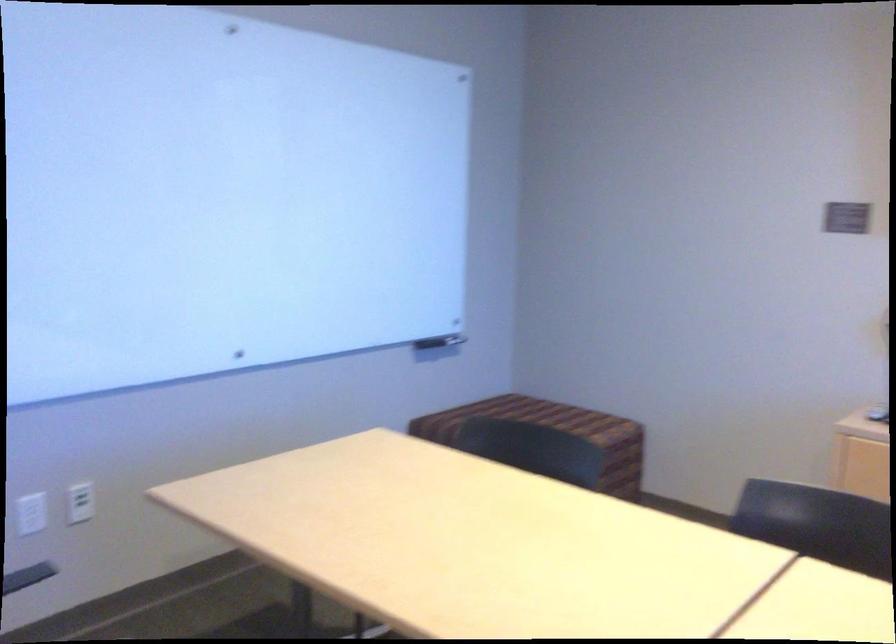
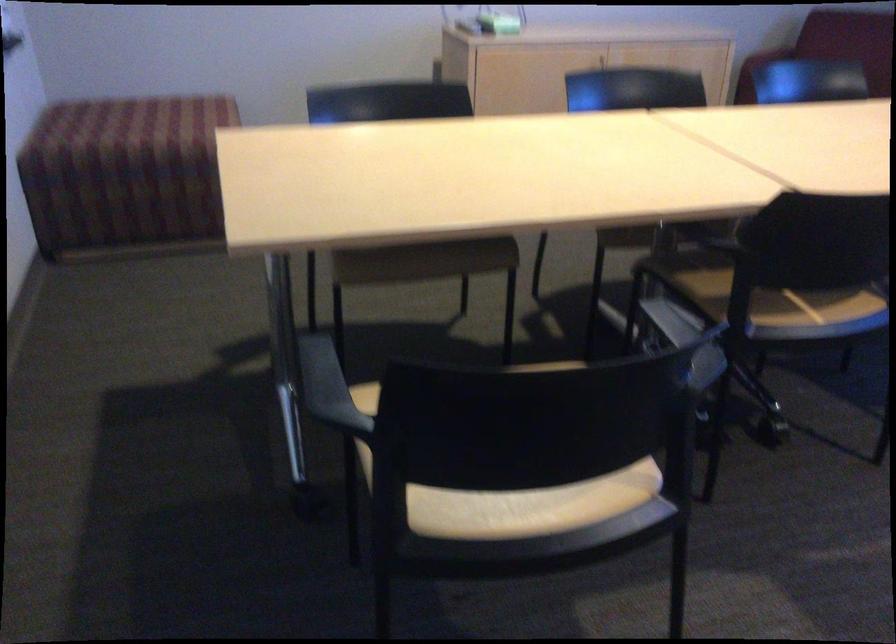
Question: I am providing you with two images of the same scene from different viewpoints. After the viewpoint changes to image2, which objects are now occluded?

Choices:
 (A) silver blender dial
 (B) light chair sitting surface
 (C) sofa sitting surface
 (D) black chair armrest

Answer: (C)